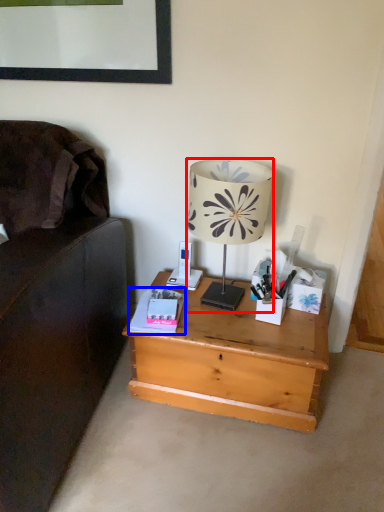
Question: Among these objects, which one is farthest to the camera, lamp (highlighted by a red box) or paperback book (highlighted by a blue box)?

Choices:
 (A) lamp
 (B) paperback book

Answer: (B)